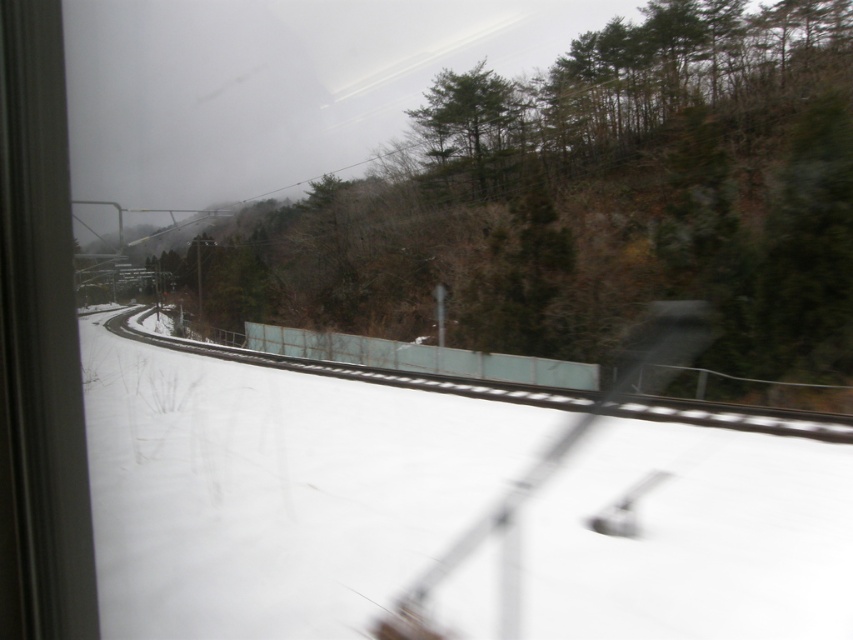
You are sitting inside a train and looking out the window. You see a snowy landscape with a railway track. There is a point marked at coordinates (276, 490). Based on the scene description, what does this point most likely represent?

The point at (276, 490) most likely represents the white snow at center, as the description states that the white snow at center is represented by that coordinate.

You are a passenger sitting inside the train and looking out the window. You notice the white snow at center and the green matte tree at upper center in your view. Which object is closer to you?

The white snow at center is closer to you because it is in front of the green matte tree at upper center.

You are sitting inside a train and looking out the window. You notice the white snow at center. Can you determine if the snow is closer to the window or further away based on its position?

The white snow at center is located at point coordinates which are relative to the observer, but without additional spatial references, it cannot be definitively determined if it is closer to the window or further away. The position alone does not provide depth information.